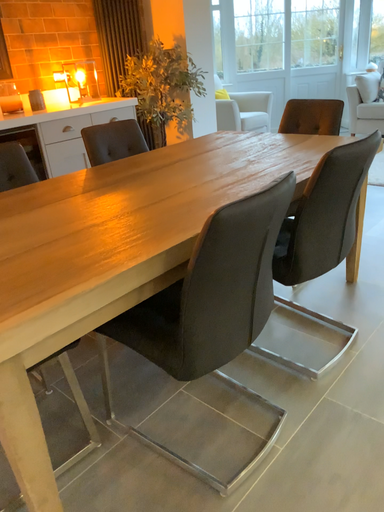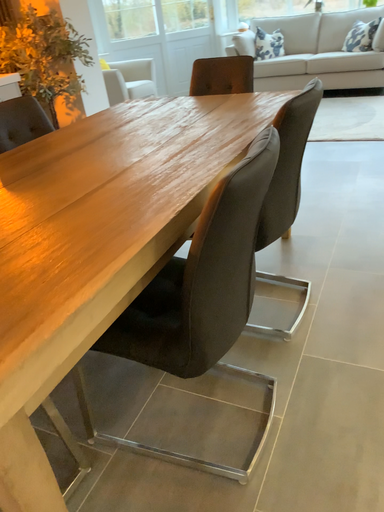
Question: How did the camera likely rotate when shooting the video?

Choices:
 (A) rotated right
 (B) rotated left

Answer: (A)